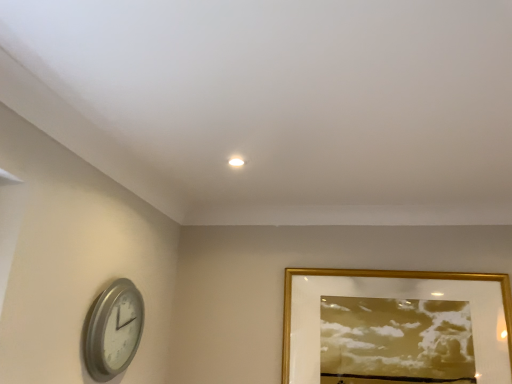
Question: Is silver metallic clock at lower left spatially inside gold metallic picture frame at upper right, or outside of it?

Choices:
 (A) inside
 (B) outside

Answer: (B)

Question: Is silver metallic clock at lower left in front of or behind gold metallic picture frame at upper right in the image?

Choices:
 (A) behind
 (B) front

Answer: (B)

Question: Considering the positions of silver metallic clock at lower left and gold metallic picture frame at upper right in the image, is silver metallic clock at lower left wider or thinner than gold metallic picture frame at upper right?

Choices:
 (A) thin
 (B) wide

Answer: (B)

Question: Visually, is gold metallic picture frame at upper right positioned to the left or to the right of silver metallic clock at lower left?

Choices:
 (A) left
 (B) right

Answer: (B)

Question: From the image's perspective, is gold metallic picture frame at upper right located above or below silver metallic clock at lower left?

Choices:
 (A) below
 (B) above

Answer: (A)

Question: Is point (486, 374) closer or farther from the camera than point (119, 369)?

Choices:
 (A) farther
 (B) closer

Answer: (A)

Question: From a real-world perspective, is gold metallic picture frame at upper right positioned above or below silver metallic clock at lower left?

Choices:
 (A) below
 (B) above

Answer: (B)